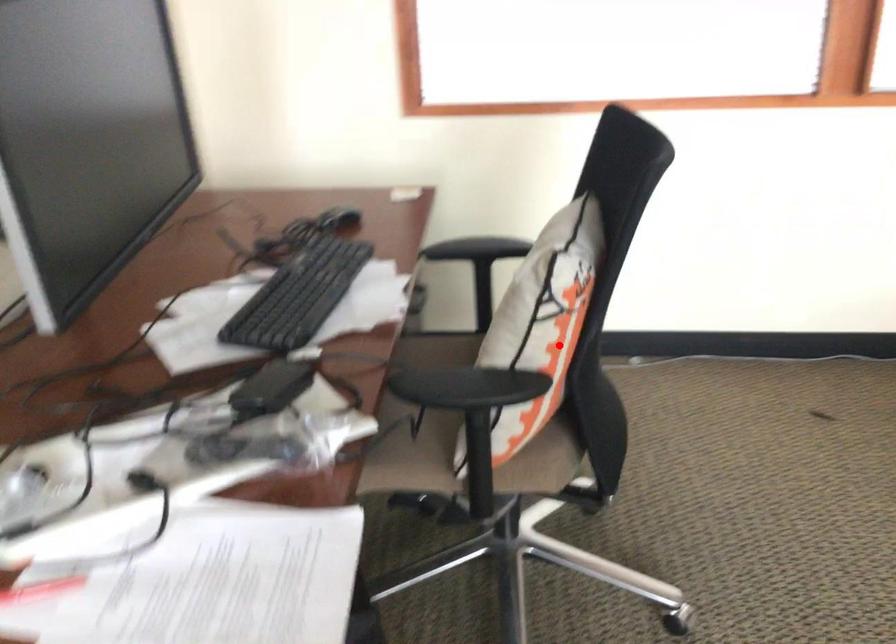
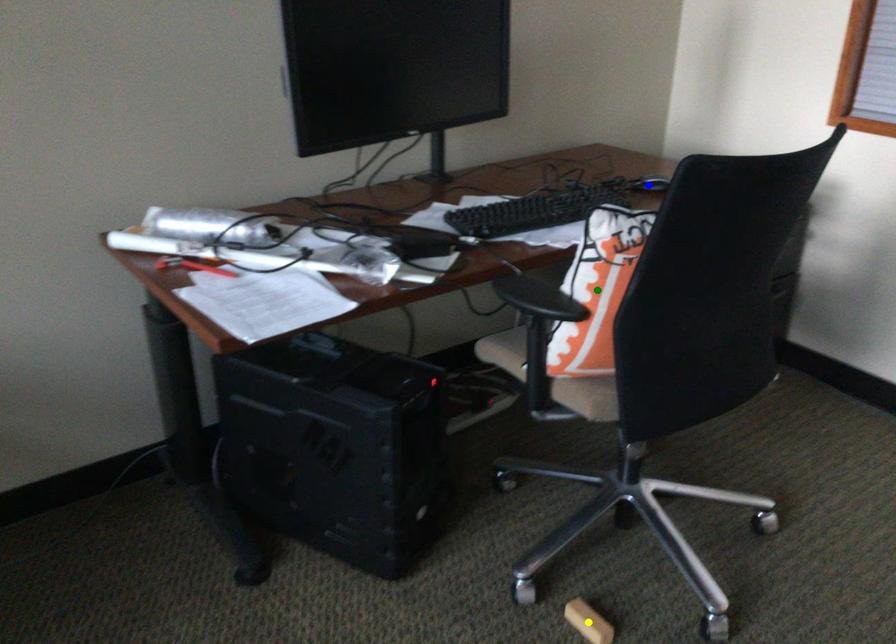
Question: I am providing you with two images of the same scene from different viewpoints. A red point is marked on the first image. You are given multiple points on the second image. Which point in image 2 is actually the same real-world point as the red point in image 1?

Choices:
 (A) blue point
 (B) yellow point
 (C) green point

Answer: (C)